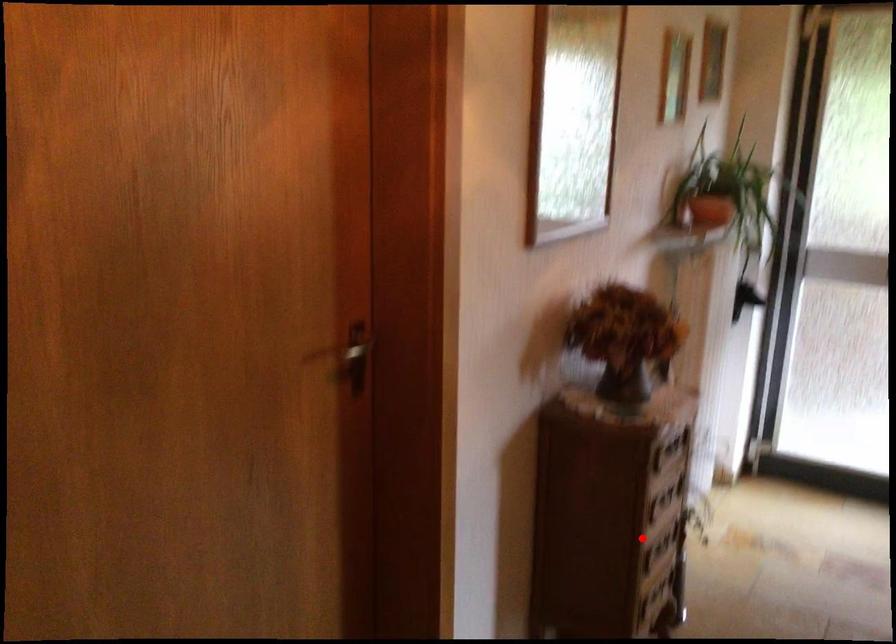
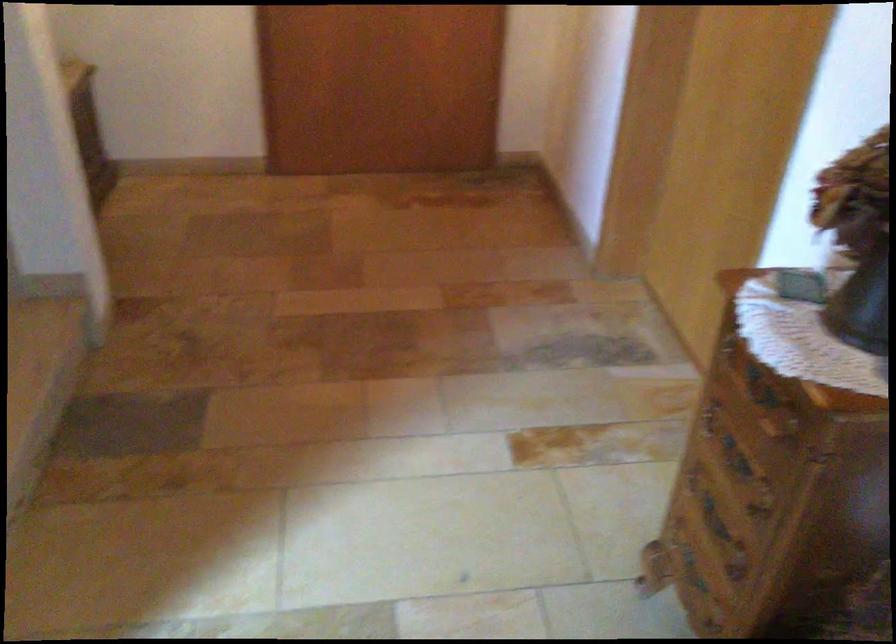
Where in the second image is the point corresponding to the highlighted location from the first image?

(735, 457)